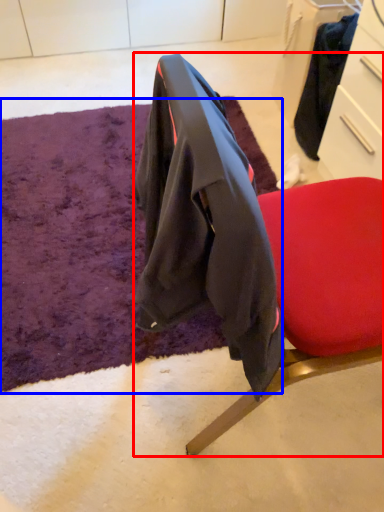
Question: Which object appears farthest to the camera in this image, chair (highlighted by a red box) or mat (highlighted by a blue box)?

Choices:
 (A) chair
 (B) mat

Answer: (B)